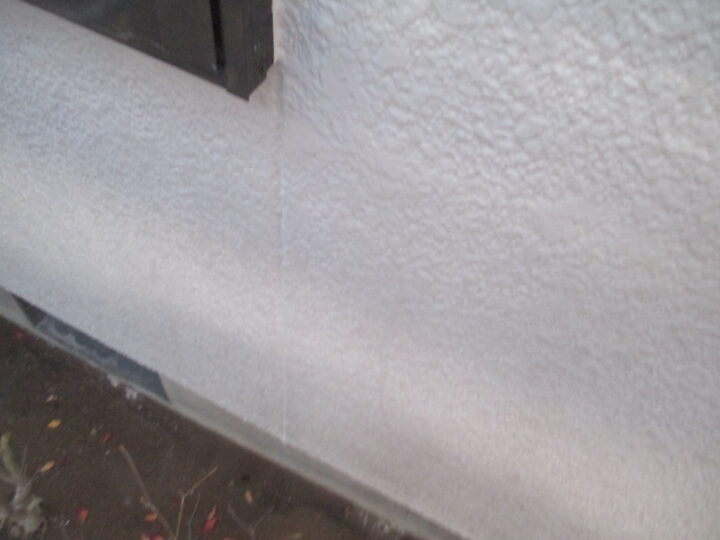
The height and width of the screenshot is (540, 720). Identify the location of window frame. (238, 54).